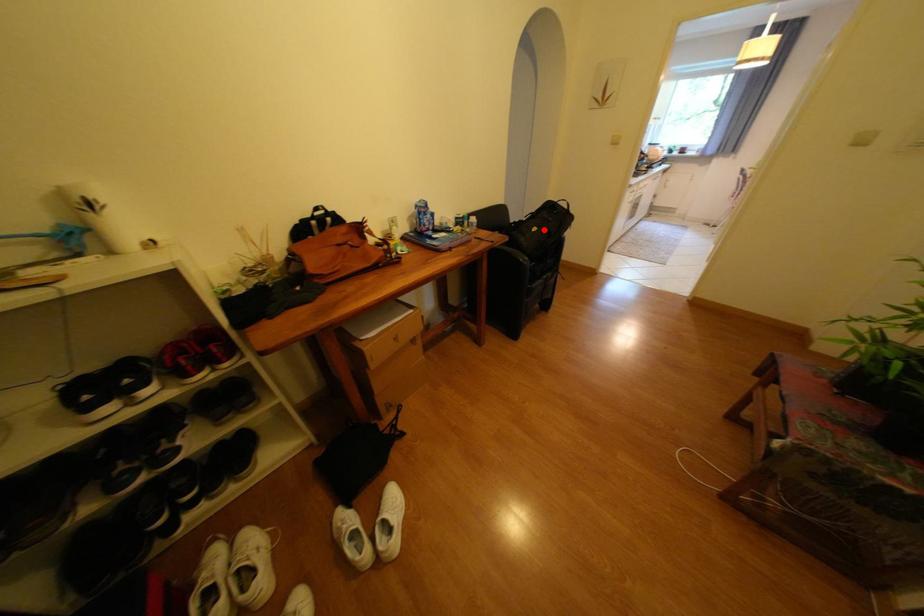
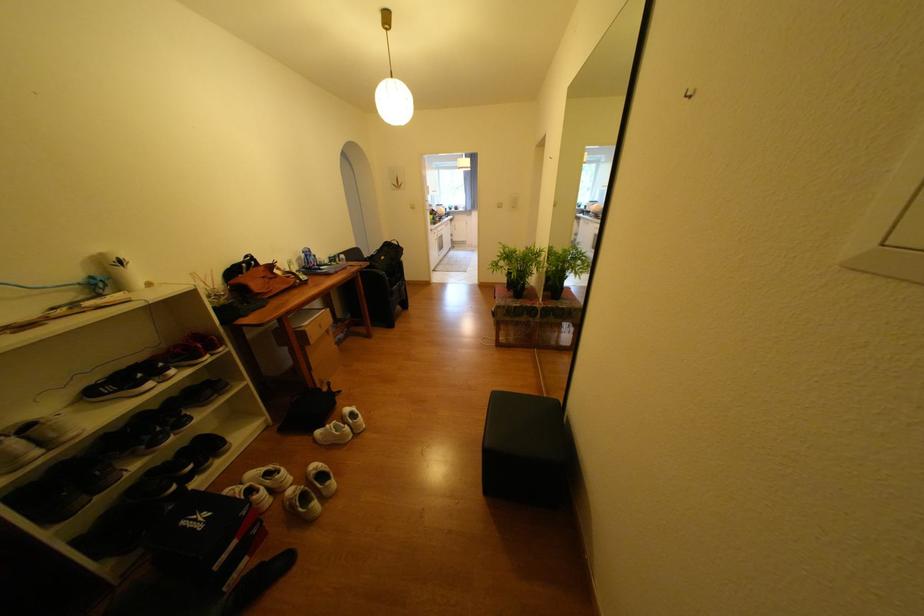
Question: I am providing you with two images of the same scene from different viewpoints. A red point is shown in image1. For the corresponding object point in image2, is it positioned nearer or farther from the camera?

Choices:
 (A) Nearer
 (B) Farther

Answer: (A)